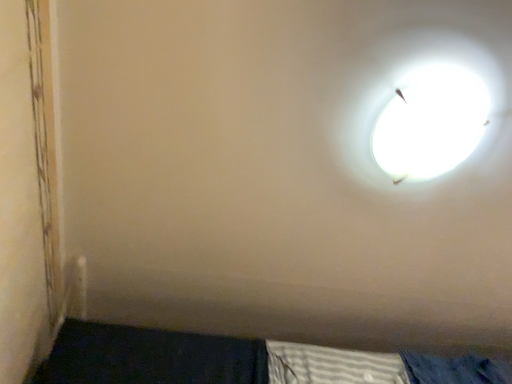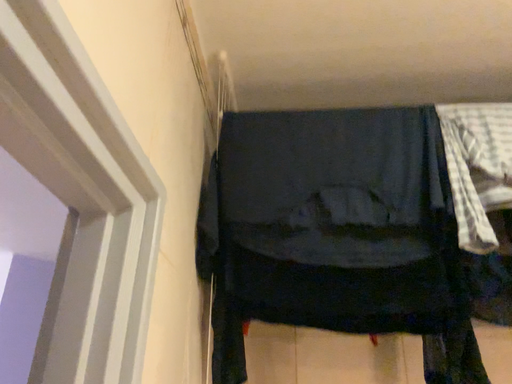
Question: Which way did the camera rotate in the video?

Choices:
 (A) rotated upward
 (B) rotated downward

Answer: (B)